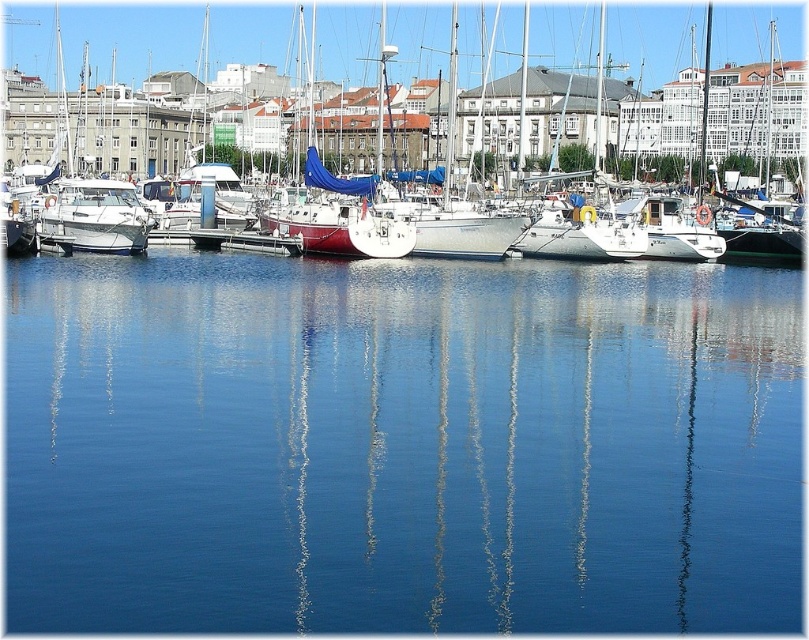
You are standing at the center of the marina and see the point marked at coordinates (96, 216). What object is located at that point?

The point at coordinates (96, 216) indicates the location of the white glossy boat at left.

You are standing at the edge of the marina looking out at the water. You notice a point marked at coordinates (132, 35). Which object is this point located on?

The point at coordinates (132, 35) is located on the white matte sailboat at center.